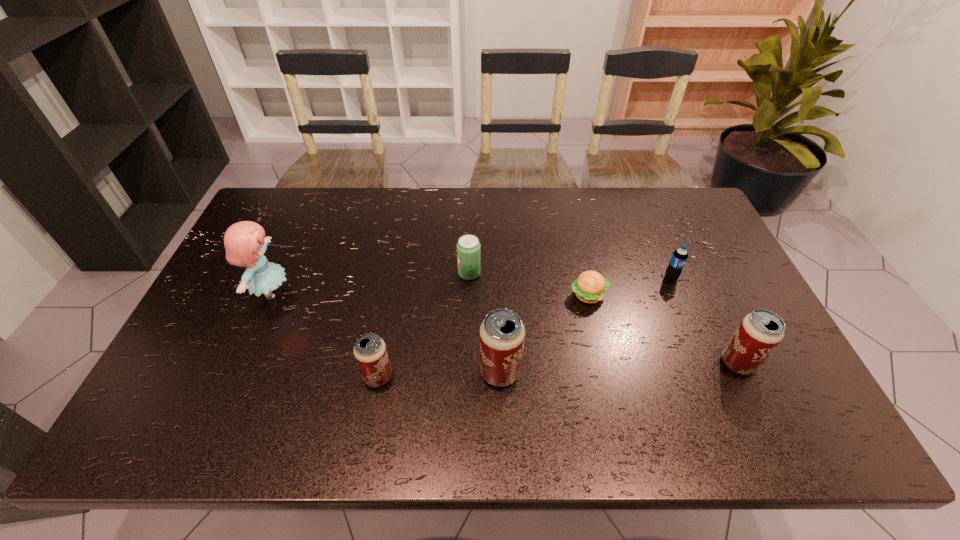
Where is `the fifth object from left to right`? The image size is (960, 540). the fifth object from left to right is located at coordinates (589, 287).

The image size is (960, 540). In order to click on vacant space located 0.380m on the left of the second object from left to right in this screenshot , I will do `click(206, 377)`.

Locate an element on the screen. This screenshot has height=540, width=960. free location located 0.140m on the left of the second beer can from left to right is located at coordinates (422, 372).

Locate an element on the screen. This screenshot has height=540, width=960. vacant point located on the left of the second shortest beer can is located at coordinates (657, 363).

Where is `blank space located 0.250m on the front-facing side of the tallest object`? The image size is (960, 540). blank space located 0.250m on the front-facing side of the tallest object is located at coordinates (379, 293).

Locate an element on the screen. Image resolution: width=960 pixels, height=540 pixels. vacant space located on the front of the right soda is located at coordinates (714, 383).

This screenshot has height=540, width=960. I want to click on blank space located on the left of the left soda, so click(441, 273).

I want to click on free space located on the right of the shortest object, so click(681, 295).

Image resolution: width=960 pixels, height=540 pixels. Identify the location of object located in the left edge section of the desktop. (245, 243).

The width and height of the screenshot is (960, 540). Find the location of `object positioned at the right edge`. object positioned at the right edge is located at coordinates (759, 333).